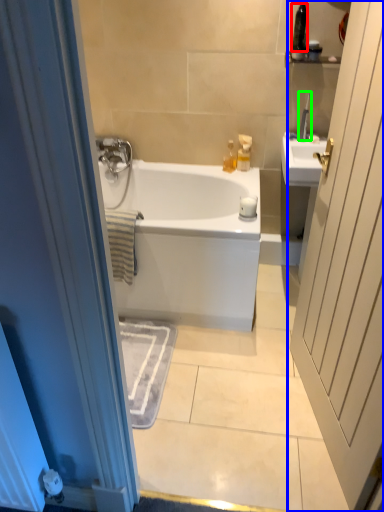
Question: Which is farther away from toiletry (highlighted by a red box)? door (highlighted by a blue box) or toiletry (highlighted by a green box)?

Choices:
 (A) door
 (B) toiletry

Answer: (A)